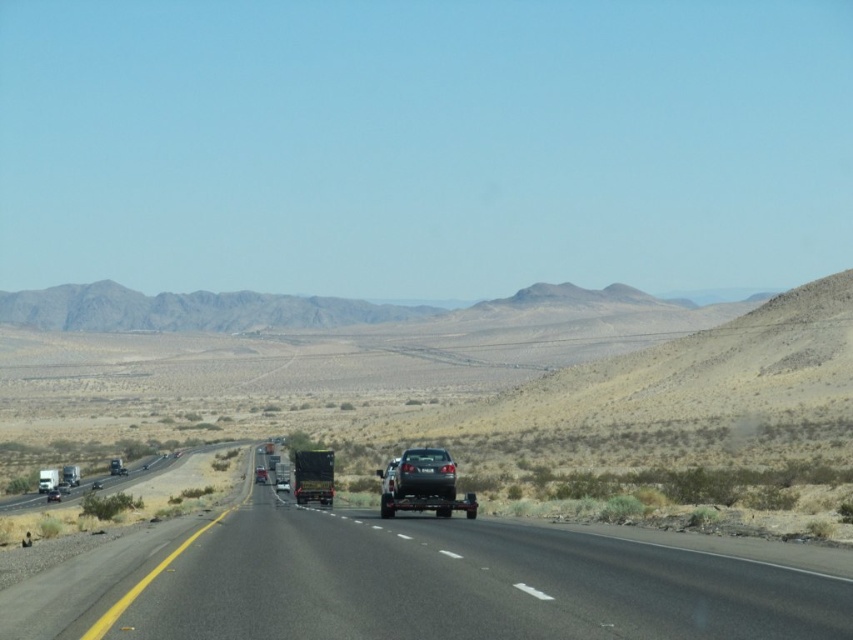
You are driving on the highway and see two points on the road ahead. The first point is at coordinates point (480, 616) and the second is at point (438, 454). Which point is closer to your current position?

Point (480, 616) is closer to the viewer than point (438, 454), so the first point is closer to your current position.

You are driving a car and see the shiny silver car at center and the glossy black truck at center on the highway. Which vehicle is positioned to the right side of the other?

The shiny silver car at center is positioned to the right of the glossy black truck at center.

You are a GPS device guiding a driver to a destination. The driver is currently at the green matte trailer truck at center. The destination is at point 0.745, 0.368. Is the driver already at the destination?

The position of green matte trailer truck at center is at point [312,476], so yes, the driver is already at the destination.